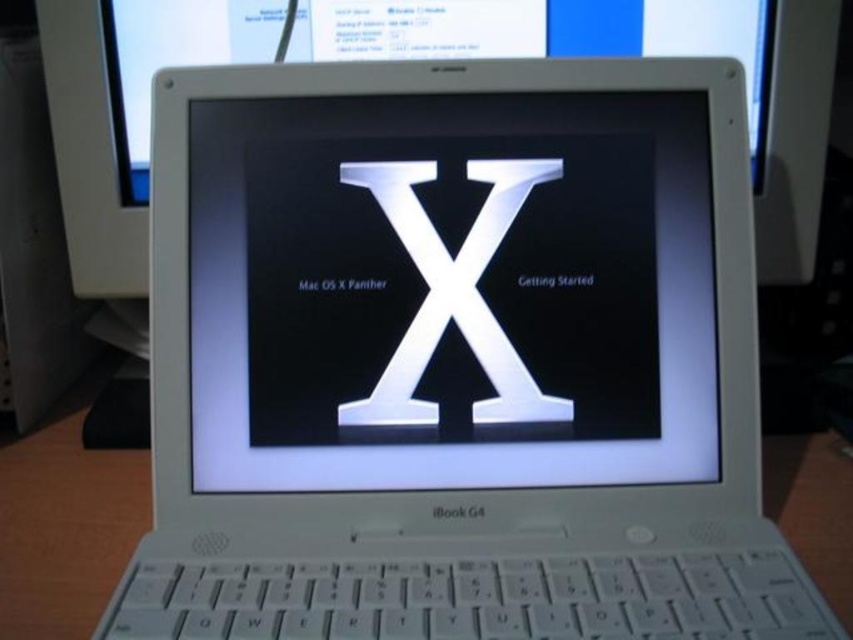
Is white glossy x at center above white plastic keyboard at center?

Yes.

Is point (268, 296) farther from camera compared to point (144, 516)?

That is False.

Where is `white glossy x at center`? white glossy x at center is located at coordinates (451, 289).

Does point (740, 33) come in front of point (770, 512)?

No, it is behind (770, 512).

Which of these two, white glossy monitor at center or white plastic keyboard at center, stands taller?

white glossy monitor at center is taller.

Is point (758, 42) closer to viewer compared to point (833, 545)?

No, (758, 42) is behind (833, 545).

This screenshot has width=853, height=640. Find the location of `white glossy monitor at center`. white glossy monitor at center is located at coordinates (645, 54).

Is white glossy x at center smaller than metallic silver letter x at center?

No.

What do you see at coordinates (451, 289) in the screenshot? I see `white glossy x at center` at bounding box center [451, 289].

Where is `white glossy x at center`? Image resolution: width=853 pixels, height=640 pixels. white glossy x at center is located at coordinates (451, 289).